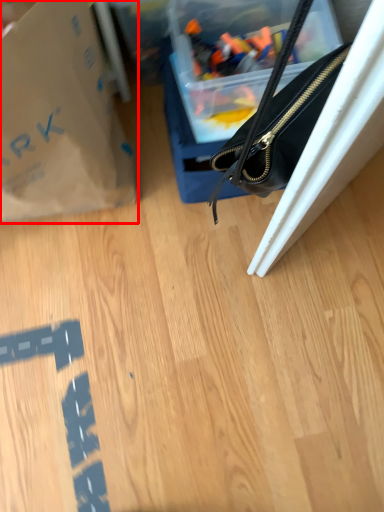
Question: From the image's perspective, what is the correct spatial relationship of tote bag (annotated by the red box) in relation to handbag?

Choices:
 (A) above
 (B) below

Answer: (B)